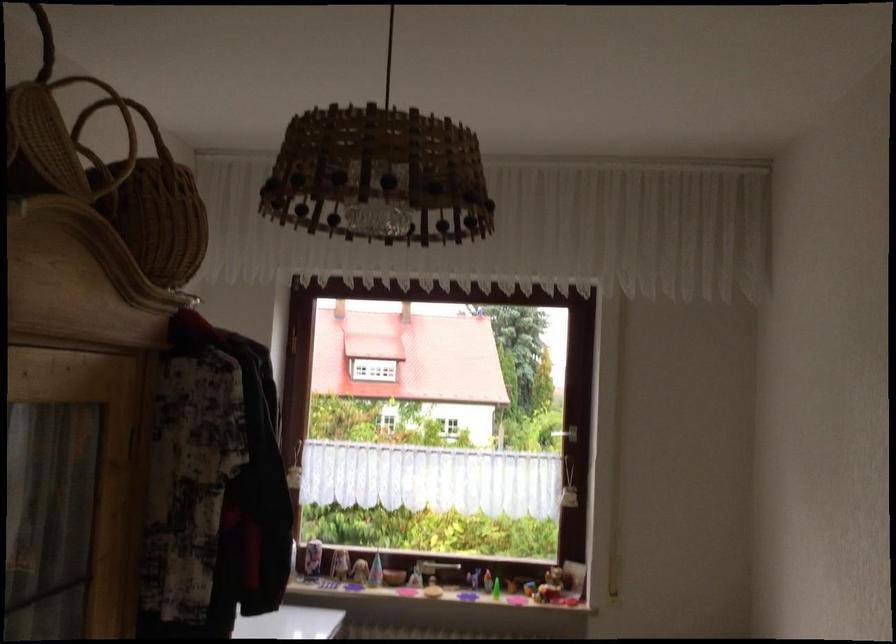
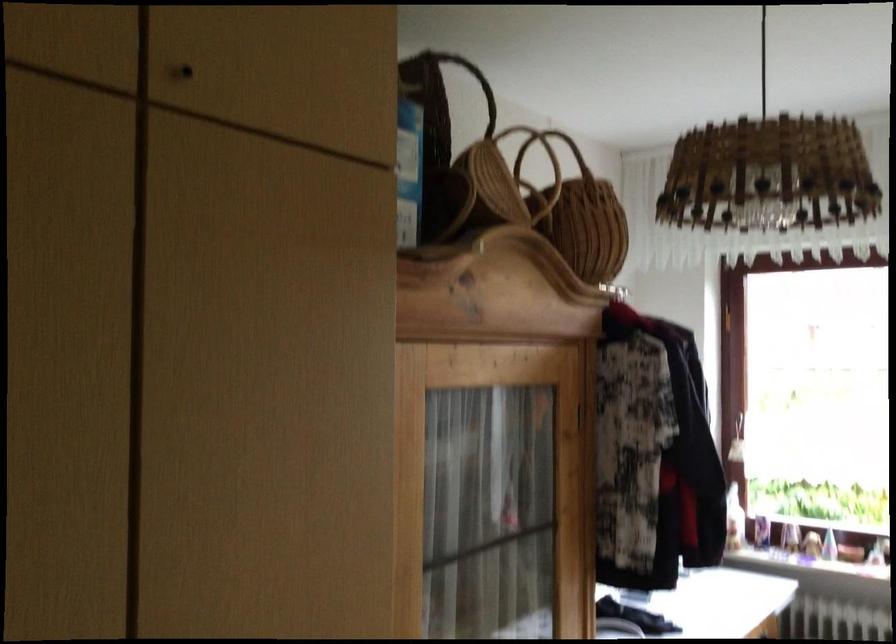
Question: Based on the continuous images, in which direction is the camera rotating? Reply with the corresponding letter.

Choices:
 (A) Left
 (B) Right
 (C) Up
 (D) Down

Answer: (A)